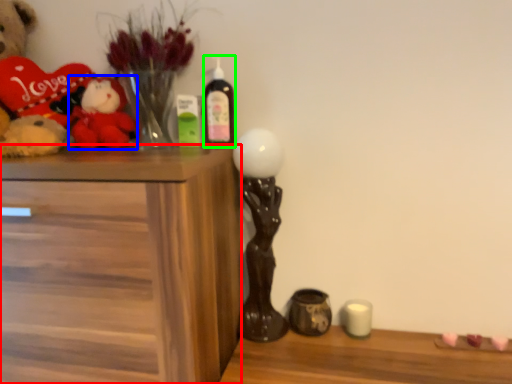
Question: Which object is the farthest from chest of drawers (highlighted by a red box)? Choose among these: toy (highlighted by a blue box) or bottle (highlighted by a green box).

Choices:
 (A) toy
 (B) bottle

Answer: (B)